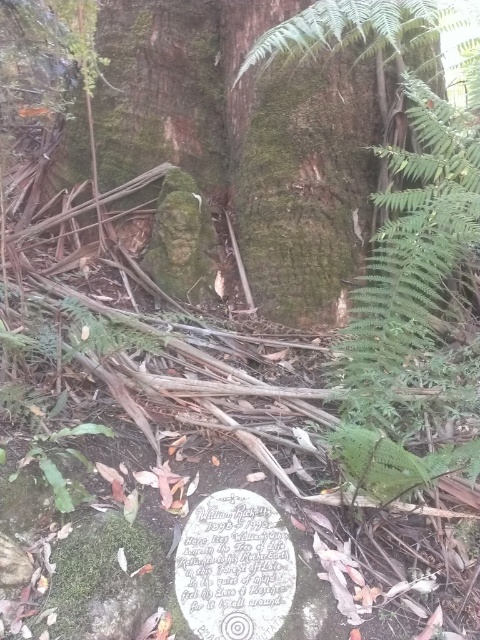
Can you confirm if green mossy tree trunk at center is taller than white stone plaque at center?

Yes, green mossy tree trunk at center is taller than white stone plaque at center.

Can you confirm if green mossy tree trunk at center is positioned to the left of white stone plaque at center?

No, green mossy tree trunk at center is not to the left of white stone plaque at center.

The image size is (480, 640). Describe the element at coordinates (247, 136) in the screenshot. I see `green mossy tree trunk at center` at that location.

What are the coordinates of `green mossy tree trunk at center` in the screenshot? It's located at (247, 136).